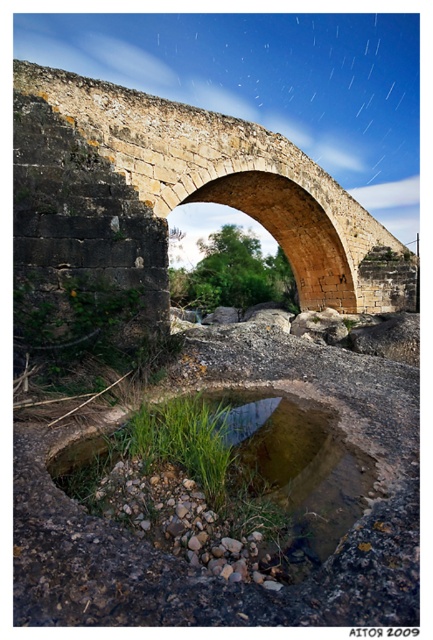
You are a photographer standing at the base of the yellowish stone bridge at center and clear water at center. You want to capture the reflection of the bridge in the water. Which object should you focus on to ensure the reflection is visible?

The clear water at center is the correct focus point because reflections are typically visible on water surfaces. Since the yellowish stone bridge at center is much taller than the clear water at center, positioning the camera to capture the reflection in the water will show the bridge.

You are standing at the edge of a riverbank and want to cross to the other side using the yellowish stone bridge at center. If your walking speed is 1.5 meters per second, how many seconds will it take you to walk from your current position to the bridge?

The yellowish stone bridge at center is 13.05 meters from viewer. At a walking speed of 1.5 meters per second, it would take 13.05 divided by 1.5, which equals approximately 8.7 seconds to reach the bridge.

You are standing on the ancient stone bridge and want to determine the position of two points marked in the image. Which point, point (180, 134) or point (223, 508), is closer to you?

Point (223, 508) is closer to you because point (180, 134) is behind it.